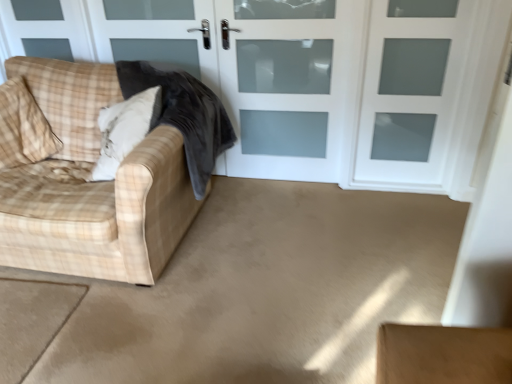
Question: From the image's perspective, is plush white pillow at left, which is the first pillow in right-to-left order, located above or below white frosted glass screen door at upper center, which is counted as the 1th screen door, starting from the right?

Choices:
 (A) above
 (B) below

Answer: (B)

Question: Relative to white frosted glass screen door at upper center, placed as the 2th screen door when sorted from left to right, is plush white pillow at left, which is the first pillow in right-to-left order, in front or behind?

Choices:
 (A) behind
 (B) front

Answer: (B)

Question: Which object is positioned closest to the white frosted glass screen door at upper center, which is counted as the 1th screen door, starting from the right?

Choices:
 (A) beige carpet at lower left
 (B) velvet dark gray blanket at left
 (C) beige fabric pillow at left, the 1th pillow positioned from the left
 (D) plaid fabric couch at left
 (E) white frosted glass door at center, marked as the 2th screen door in a right-to-left arrangement

Answer: (E)

Question: Considering the real-world distances, which object is closest to the velvet dark gray blanket at left?

Choices:
 (A) beige carpet at lower left
 (B) white frosted glass door at center, marked as the 2th screen door in a right-to-left arrangement
 (C) plush white pillow at left, the second pillow from the left
 (D) beige fabric pillow at left, the second pillow when ordered from right to left
 (E) white frosted glass screen door at upper center, which is counted as the 1th screen door, starting from the right

Answer: (C)